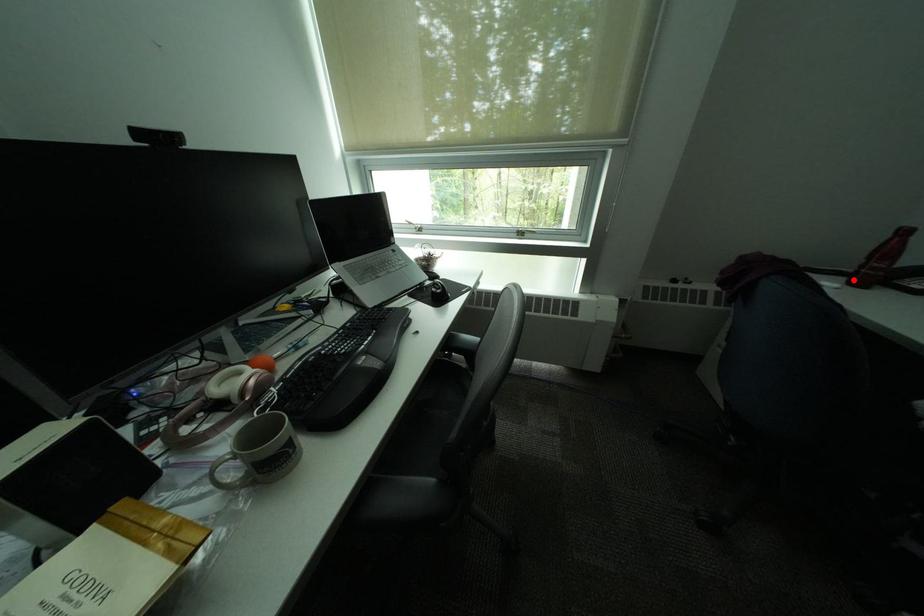
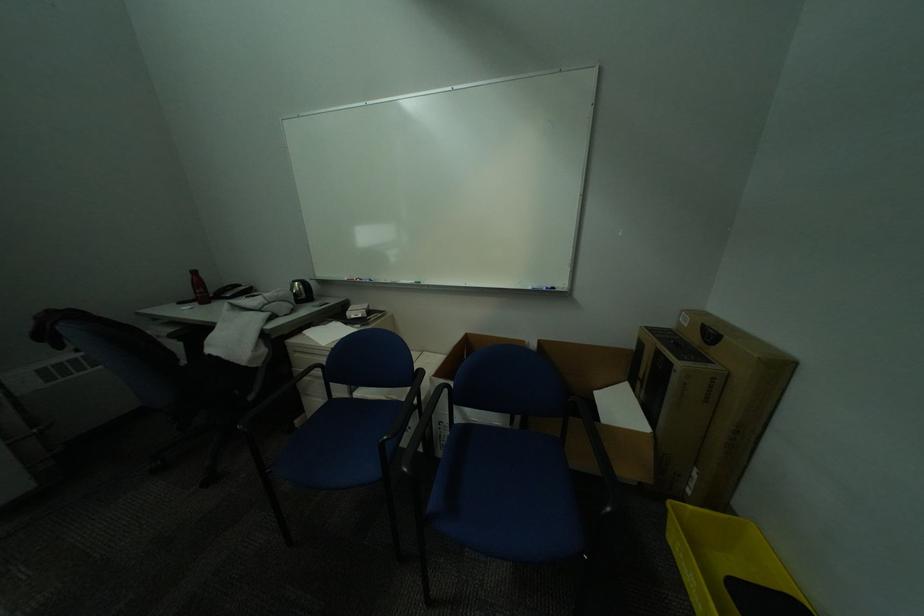
In the second image, find the point that corresponds to the highlighted location in the first image.

(208, 304)